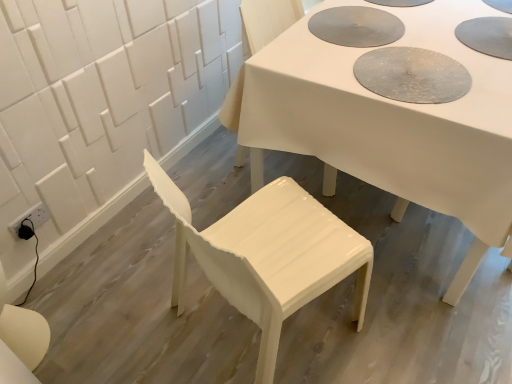
Question: From a real-world perspective, does glossy white chair at lower center, acting as the 2th chair starting from the top, sit lower than white glossy chair at center, which ranks as the first chair in top-to-bottom order?

Choices:
 (A) yes
 (B) no

Answer: (A)

Question: Does glossy white chair at lower center, acting as the 2th chair starting from the top, appear on the left side of white glossy chair at center, the second chair positioned from the bottom?

Choices:
 (A) no
 (B) yes

Answer: (B)

Question: From the image's perspective, would you say glossy white chair at lower center, acting as the 2th chair starting from the top, is shown under white glossy chair at center, which ranks as the 1th chair in back-to-front order?

Choices:
 (A) no
 (B) yes

Answer: (B)

Question: Is glossy white chair at lower center, which is the 1th chair from bottom to top, further to the viewer compared to white glossy chair at center, the second chair positioned from the bottom?

Choices:
 (A) yes
 (B) no

Answer: (B)

Question: Does glossy white chair at lower center, acting as the 2th chair starting from the top, turn towards white glossy chair at center, the second chair in the front-to-back sequence?

Choices:
 (A) no
 (B) yes

Answer: (A)

Question: From the image's perspective, would you say glossy white chair at lower center, acting as the 2th chair starting from the top, is positioned over white glossy chair at center, which ranks as the first chair in top-to-bottom order?

Choices:
 (A) no
 (B) yes

Answer: (A)

Question: Is white glossy chair at center, the second chair in the front-to-back sequence, far from white glossy table at center?

Choices:
 (A) no
 (B) yes

Answer: (A)

Question: Is white glossy chair at center, which ranks as the 1th chair in back-to-front order, not within white glossy table at center?

Choices:
 (A) no
 (B) yes

Answer: (A)

Question: Is white glossy table at center located within white glossy chair at center, the second chair positioned from the bottom?

Choices:
 (A) no
 (B) yes

Answer: (A)

Question: Considering the relative positions of white glossy chair at center, which ranks as the 1th chair in back-to-front order, and white glossy table at center in the image provided, is white glossy chair at center, which ranks as the 1th chair in back-to-front order, behind white glossy table at center?

Choices:
 (A) yes
 (B) no

Answer: (A)

Question: From the image's perspective, would you say white glossy chair at center, which ranks as the 1th chair in back-to-front order, is positioned over white glossy table at center?

Choices:
 (A) yes
 (B) no

Answer: (B)

Question: Is white glossy chair at center, the second chair positioned from the bottom, in contact with white glossy table at center?

Choices:
 (A) yes
 (B) no

Answer: (B)

Question: From the image's perspective, is white glossy chair at center, which ranks as the first chair in top-to-bottom order, below glossy white chair at lower center, the first chair when ordered from front to back?

Choices:
 (A) no
 (B) yes

Answer: (A)